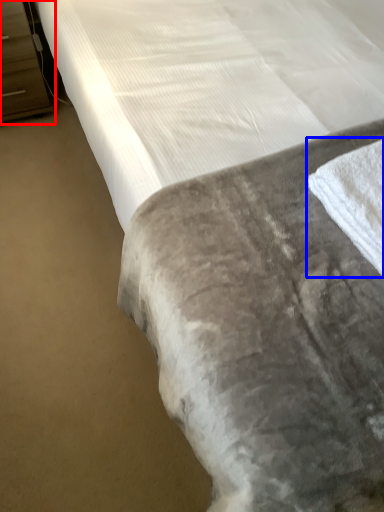
Question: Among these objects, which one is farthest to the camera, dresser (highlighted by a red box) or bath towel (highlighted by a blue box)?

Choices:
 (A) dresser
 (B) bath towel

Answer: (A)